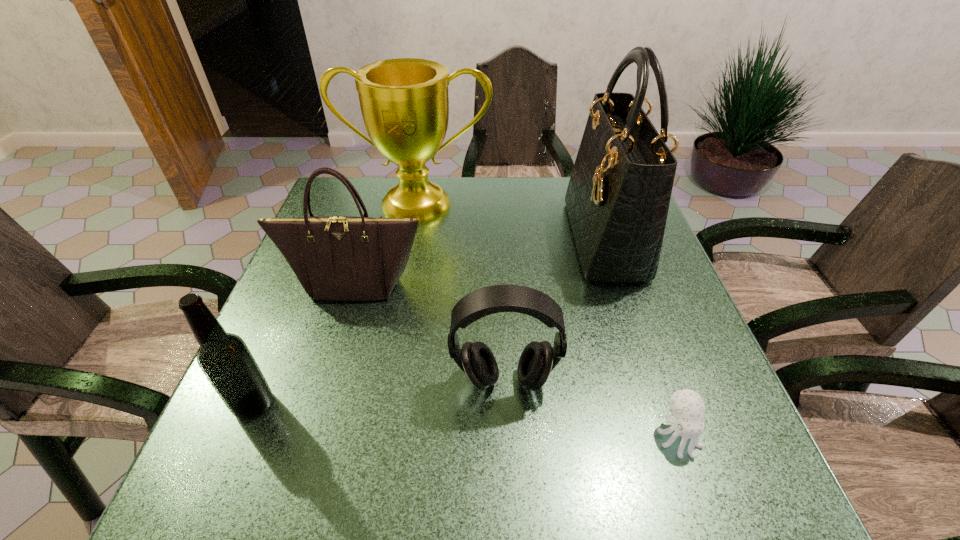
Where is `object that is the fifth closest to the fifth shortest object`? object that is the fifth closest to the fifth shortest object is located at coordinates (687, 406).

Locate an element on the screen. The width and height of the screenshot is (960, 540). object that stands as the third closest to the beer bottle is located at coordinates (404, 102).

Where is `vacant space that satisfies the following two spatial constraints: 1. at the front of the taller handbag with visible charms; 2. on the front-facing side of the left handbag`? vacant space that satisfies the following two spatial constraints: 1. at the front of the taller handbag with visible charms; 2. on the front-facing side of the left handbag is located at coordinates (619, 284).

Locate an element on the screen. This screenshot has height=540, width=960. free space in the image that satisfies the following two spatial constraints: 1. at the front of the tallest object with visible charms; 2. on the ear cups of the fifth tallest object is located at coordinates (652, 380).

I want to click on vacant region that satisfies the following two spatial constraints: 1. at the front of the taller handbag with visible charms; 2. on the front-facing side of the left handbag, so click(619, 284).